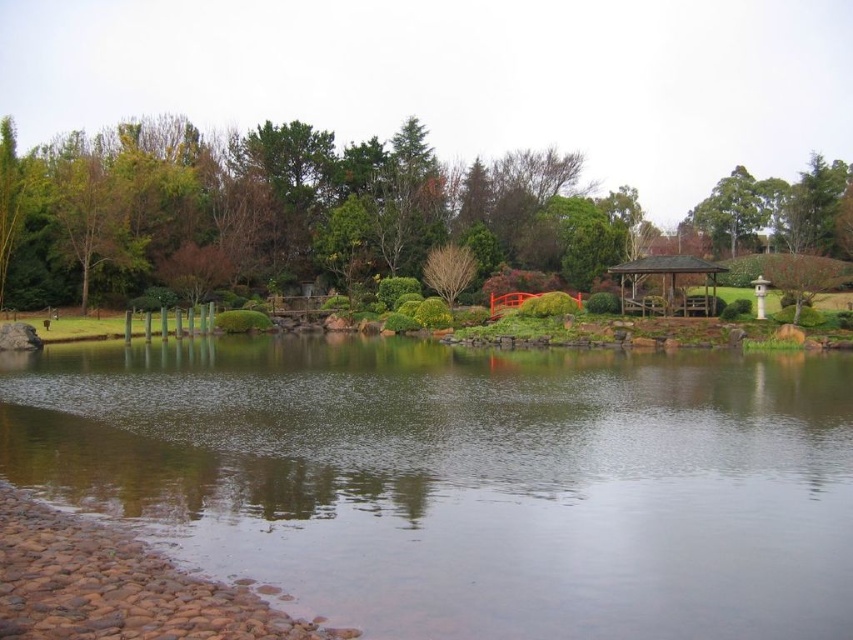
You are planning to place a small decorative boat in the garden. The boat requires a water area wider than the green leafy tree at upper center to navigate comfortably. Based on the scene, will the clear water at center provide enough space for the boat?

The clear water at center has a lesser width compared to the green leafy tree at upper center, so it will not provide enough space for the boat that requires a wider area than the tree.